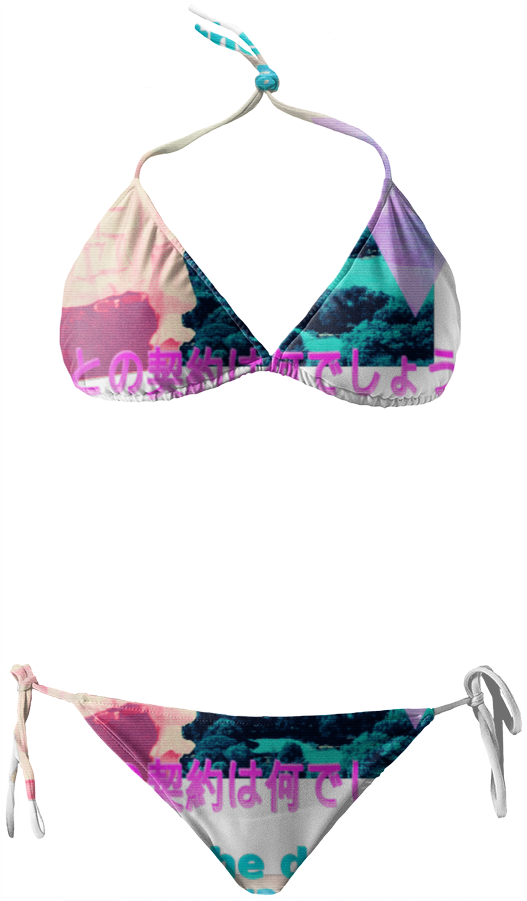
This screenshot has width=527, height=901. In order to click on fabric in this screenshot , I will do `click(269, 769)`.